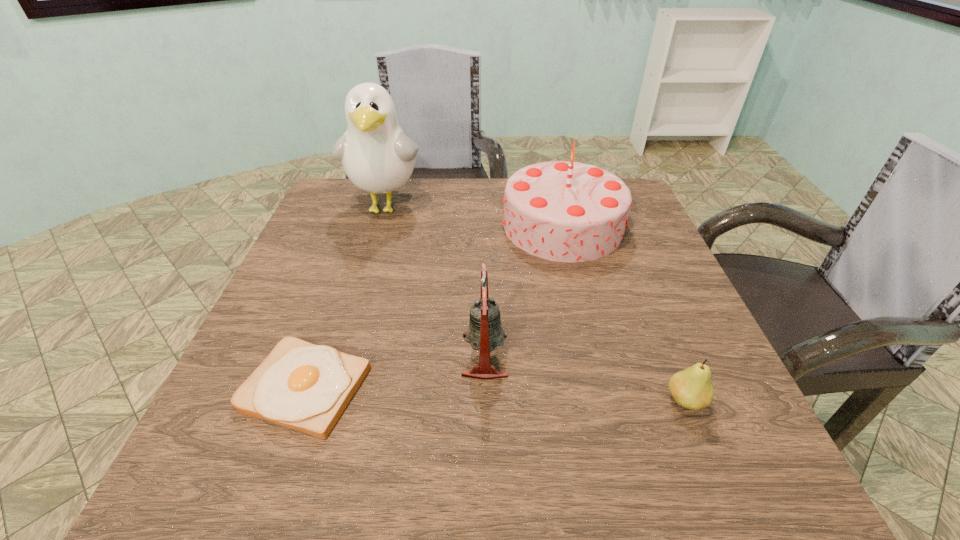
Locate an element on the screen. This screenshot has width=960, height=540. blank region between the shortest object and the bell is located at coordinates (396, 371).

Image resolution: width=960 pixels, height=540 pixels. I want to click on unoccupied area between the fourth shortest object and the tallest object, so click(474, 216).

Where is `unoccupied position between the bell and the toast`? unoccupied position between the bell and the toast is located at coordinates (396, 371).

Identify the location of unoccupied position between the toast and the third object from left to right. (396, 371).

Find the location of a particular element. This screenshot has width=960, height=540. vacant space that is in between the second shortest object and the birthday cake is located at coordinates (624, 313).

Locate an element on the screen. This screenshot has width=960, height=540. vacant area that lies between the shortest object and the birthday cake is located at coordinates (434, 306).

Identify the location of unoccupied position between the gull and the birthday cake. (474, 216).

The height and width of the screenshot is (540, 960). I want to click on object that ranks as the second closest to the shortest object, so click(566, 211).

The image size is (960, 540). I want to click on object that is the third closest to the birthday cake, so click(x=691, y=388).

Identify the location of free spot that satisfies the following two spatial constraints: 1. on the beak of the birthday cake; 2. on the right side of the gull. This screenshot has width=960, height=540. (380, 226).